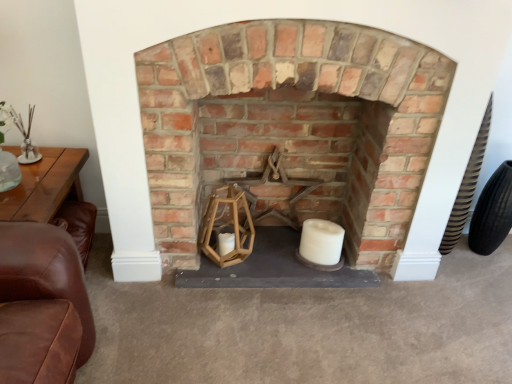
You are a GUI agent. You are given a task and a screenshot of the screen. Output one action in this format:
    pyautogui.click(x=<x>, y=<y>)
    Task: Click on the free space in front of black rubber tire at right
    This screenshot has width=512, height=384.
    Given the screenshot: What is the action you would take?
    pyautogui.click(x=489, y=276)